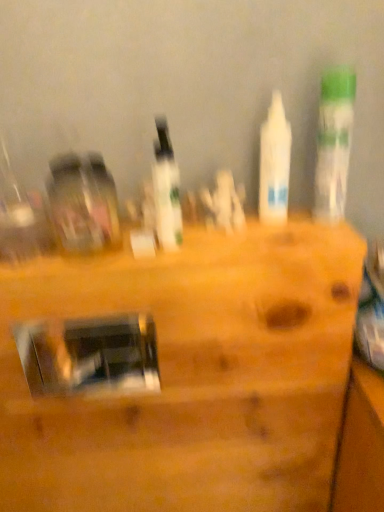
You are a GUI agent. You are given a task and a screenshot of the screen. Output one action in this format:
    pyautogui.click(x=<x>, y=<y>)
    Task: Click on the free space above metallic silver mirror at center (from a real-world perspective)
    The image size is (384, 512).
    Given the screenshot: What is the action you would take?
    pyautogui.click(x=155, y=237)